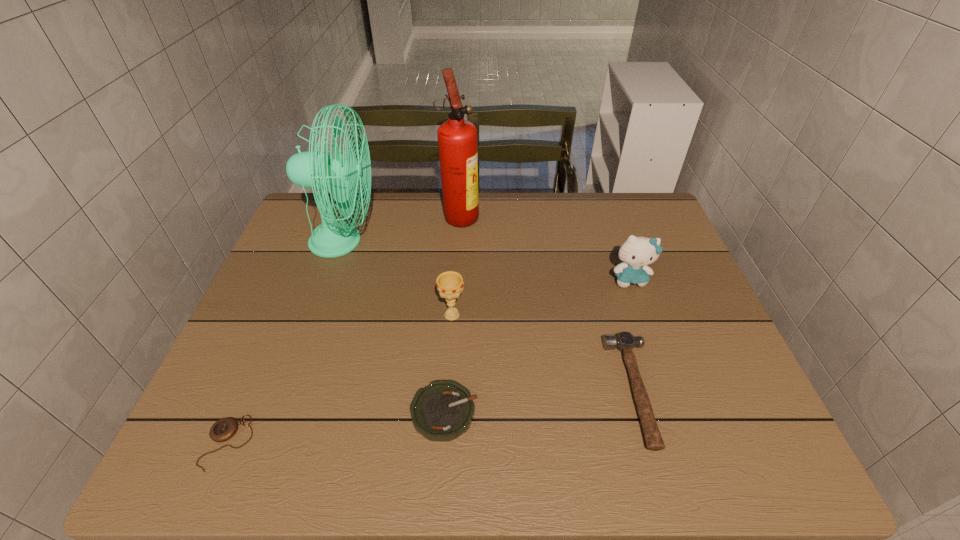
Where is `fire extinguisher`? fire extinguisher is located at coordinates (457, 138).

Locate an element on the screen. The height and width of the screenshot is (540, 960). fan is located at coordinates (314, 169).

Where is `kitten`? The image size is (960, 540). kitten is located at coordinates (636, 253).

Image resolution: width=960 pixels, height=540 pixels. I want to click on chalice, so click(x=449, y=284).

At what (x,y) coordinates should I click in order to perform the action: click on the fourth farthest object. Please return your answer as a coordinate pair (x, y). Image resolution: width=960 pixels, height=540 pixels. Looking at the image, I should click on (449, 284).

This screenshot has width=960, height=540. I want to click on hammer, so click(624, 341).

What are the coordinates of `the second shortest object` in the screenshot? It's located at (443, 410).

In order to click on the shortest object in this screenshot , I will do `click(222, 430)`.

Identify the location of vacant space located on the front-facing side of the fire extinguisher. (565, 215).

What are the coordinates of `vacant space located in front of the fan to blow air` in the screenshot? It's located at pyautogui.click(x=509, y=241).